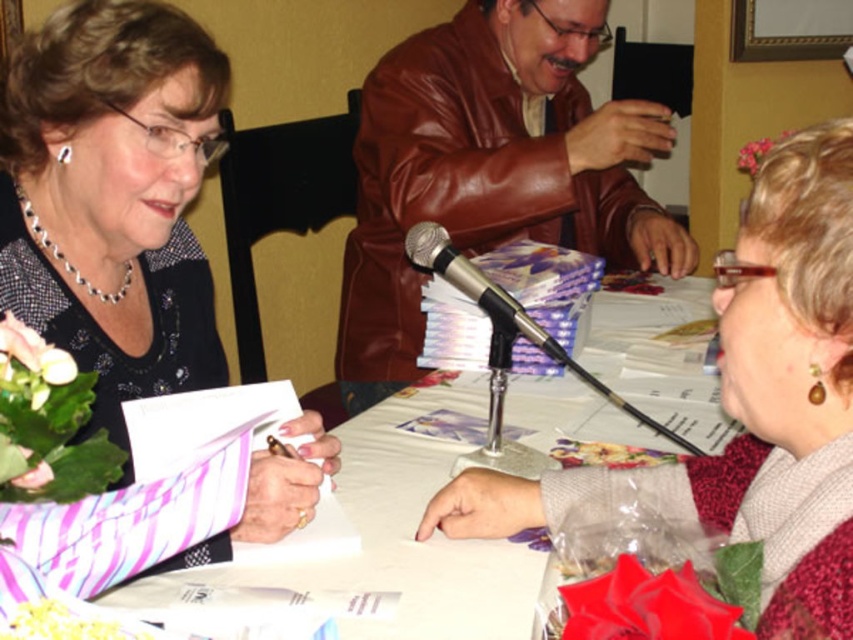
Between matte black card at center and white paper at center, which one has less height?

white paper at center is shorter.

Does matte black card at center have a greater width compared to white paper at center?

Yes, matte black card at center is wider than white paper at center.

Which is in front, point (161, 93) or point (120, 531)?

Positioned in front is point (120, 531).

The width and height of the screenshot is (853, 640). Identify the location of matte black card at center. (112, 195).

Which is more to the right, matte black card at center or brown leather jacket at center?

From the viewer's perspective, brown leather jacket at center appears more on the right side.

Describe the element at coordinates (112, 195) in the screenshot. I see `matte black card at center` at that location.

I want to click on matte black card at center, so click(x=112, y=195).

Who is lower down, matte brown jacket at center or metallic silver microphone at center?

matte brown jacket at center

Identify the location of matte brown jacket at center. This screenshot has width=853, height=640. (747, 404).

Find the location of a particular element. matte brown jacket at center is located at coordinates (747, 404).